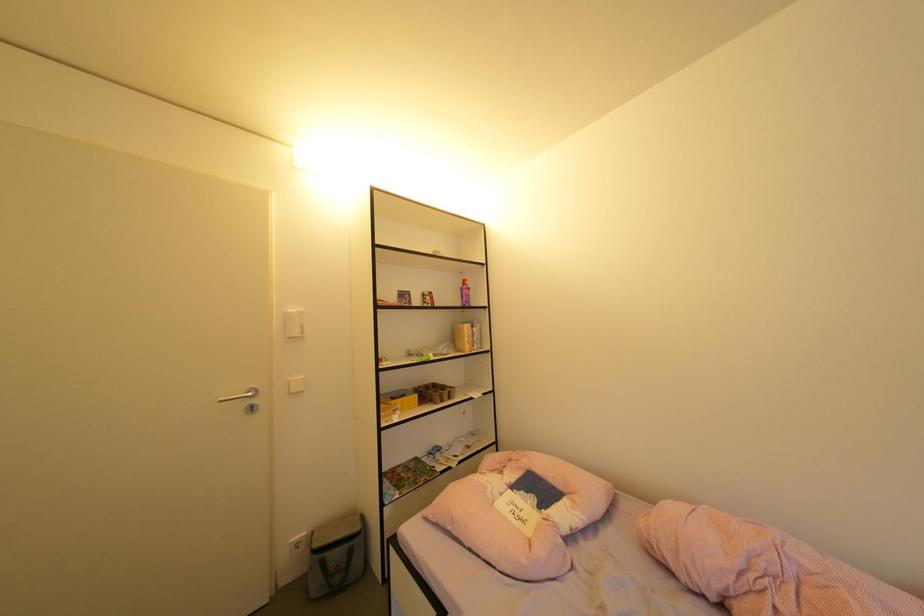
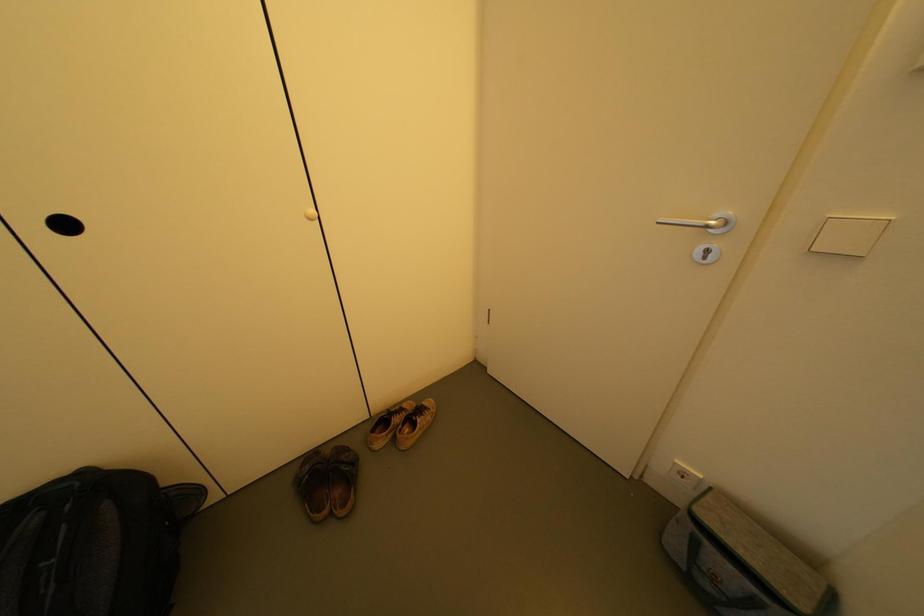
Based on the continuous images, in which direction is the camera rotating?

The camera's rotation is toward left-down.